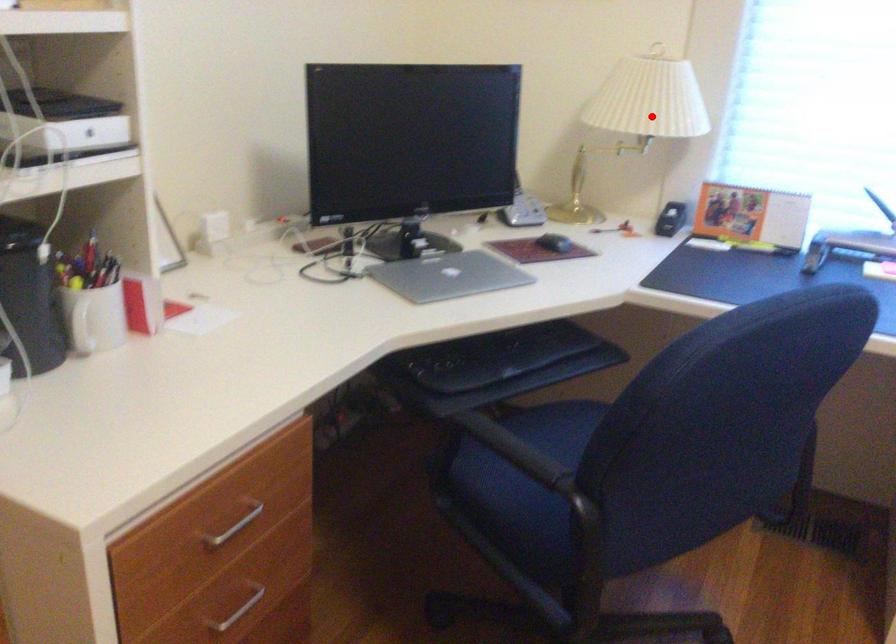
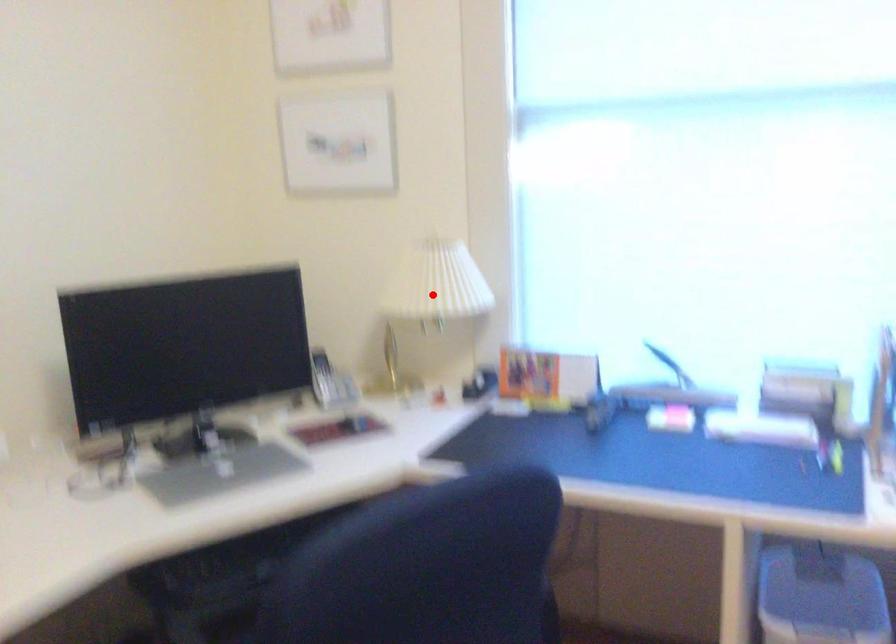
I am providing you with two images of the same scene from different viewpoints. A red point is marked on the first image and another point is marked on the second image. Does the point marked in image1 correspond to the same location as the one in image2?

Yes